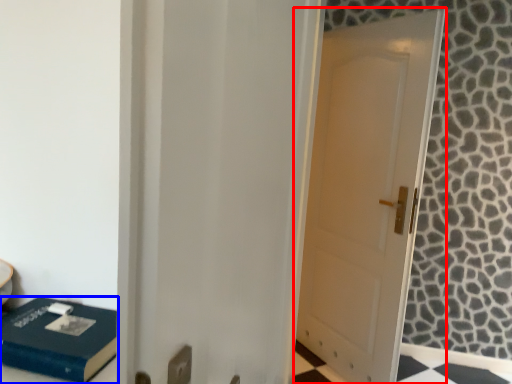
Question: Which object is further to the camera taking this photo, door (highlighted by a red box) or box (highlighted by a blue box)?

Choices:
 (A) door
 (B) box

Answer: (A)